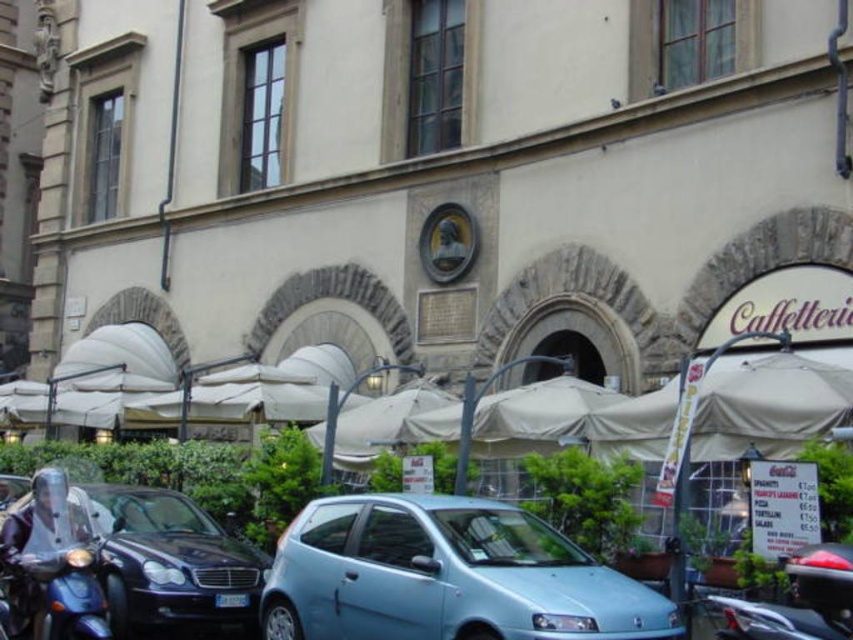
Question: Which point is closer to the camera taking this photo?

Choices:
 (A) (125, 605)
 (B) (51, 488)

Answer: (B)

Question: Considering the relative positions of light blue metallic hatchback at center and shiny black car at left in the image provided, where is light blue metallic hatchback at center located with respect to shiny black car at left?

Choices:
 (A) right
 (B) left

Answer: (A)

Question: Which point appears farthest from the camera in this image?

Choices:
 (A) (198, 609)
 (B) (55, 504)

Answer: (A)

Question: Can you confirm if shiny black car at left is positioned to the right of metallic blue scooter at lower left?

Choices:
 (A) yes
 (B) no

Answer: (A)

Question: Which of the following is the closest to the observer?

Choices:
 (A) shiny black car at left
 (B) metallic blue scooter at lower left
 (C) light blue metallic hatchback at center

Answer: (C)

Question: Can you confirm if light blue metallic hatchback at center is smaller than metallic blue scooter at lower left?

Choices:
 (A) no
 (B) yes

Answer: (A)